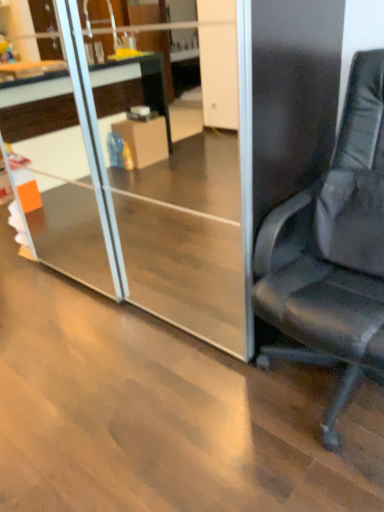
I want to click on black leather chair at right, so click(x=333, y=251).

The image size is (384, 512). What do you see at coordinates (333, 251) in the screenshot? I see `black leather chair at right` at bounding box center [333, 251].

This screenshot has height=512, width=384. In order to click on black leather chair at right in this screenshot , I will do `click(333, 251)`.